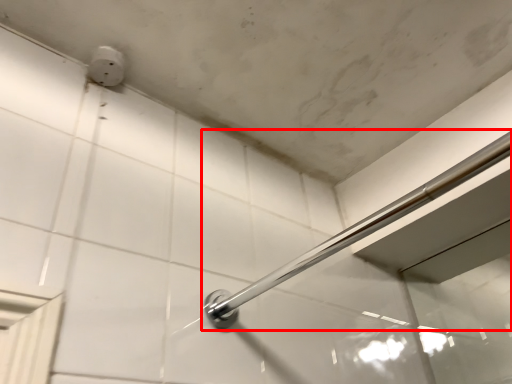
Question: From the image's perspective, what is the correct spatial positioning of door handle (annotated by the red box) in reference to electric outlet?

Choices:
 (A) below
 (B) above

Answer: (A)